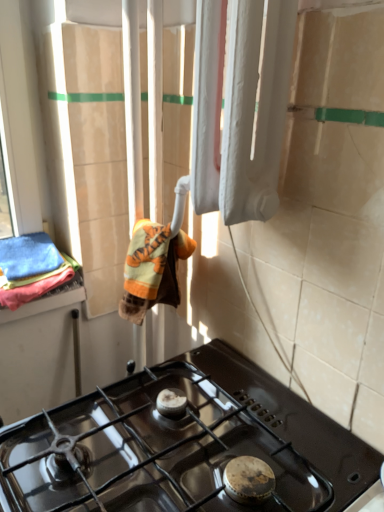
Question: From a real-world perspective, is white matte radiator at upper center positioned above or below orange plush bath towel at center, acting as the second bath towel starting from the left?

Choices:
 (A) below
 (B) above

Answer: (B)

Question: From the image's perspective, is white matte radiator at upper center located above or below orange plush bath towel at center, which appears as the 1th bath towel when viewed from the right?

Choices:
 (A) above
 (B) below

Answer: (A)

Question: Which of these objects is positioned farthest from the black glass gas stove at lower center?

Choices:
 (A) white matte radiator at upper center
 (B) soft cotton towels at left, marked as the first bath towel in a left-to-right arrangement
 (C) orange plush bath towel at center, which appears as the 1th bath towel when viewed from the right

Answer: (B)

Question: Estimate the real-world distances between objects in this image. Which object is closer to the black glass gas stove at lower center?

Choices:
 (A) white matte radiator at upper center
 (B) soft cotton towels at left, the 2th bath towel from the right
 (C) orange plush bath towel at center, which appears as the 1th bath towel when viewed from the right

Answer: (C)